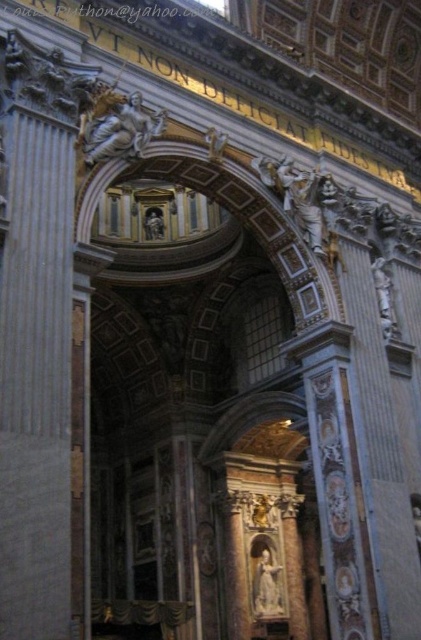
Question: Which of the following is the closest to the observer?

Choices:
 (A) white marble statue at right
 (B) white marble statue at center
 (C) white marble statue at upper center

Answer: (C)

Question: Which point appears farthest from the camera in this image?

Choices:
 (A) (272, 596)
 (B) (378, 305)
 (C) (133, 145)

Answer: (A)

Question: Considering the relative positions of white marble statue at upper center and white marble statue at center in the image provided, where is white marble statue at upper center located with respect to white marble statue at center?

Choices:
 (A) right
 (B) left

Answer: (B)

Question: Is white marble statue at upper center above white marble statue at center?

Choices:
 (A) yes
 (B) no

Answer: (A)

Question: Estimate the real-world distances between objects in this image. Which object is farther from the white marble statue at center?

Choices:
 (A) white marble statue at upper center
 (B) white marble statue at right

Answer: (A)

Question: Does white marble statue at upper center have a smaller size compared to white marble statue at right?

Choices:
 (A) no
 (B) yes

Answer: (A)